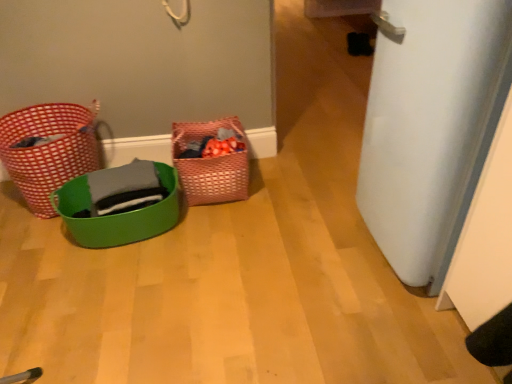
The width and height of the screenshot is (512, 384). In order to click on free space above red woven basket at left, the third basket when ordered from right to left (from a real-world perspective) in this screenshot , I will do `click(58, 122)`.